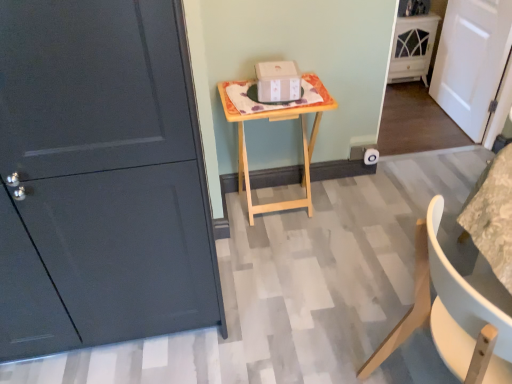
Image resolution: width=512 pixels, height=384 pixels. Identify the location of blank space above white cardboard box at center (from a real-world perspective). click(x=275, y=65).